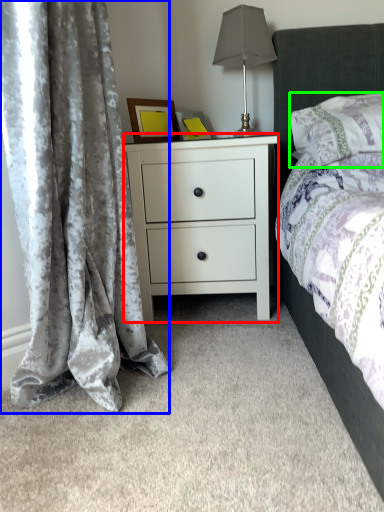
Question: Which is nearer to the nightstand (highlighted by a red box)? curtain (highlighted by a blue box) or pillow (highlighted by a green box).

Choices:
 (A) curtain
 (B) pillow

Answer: (B)